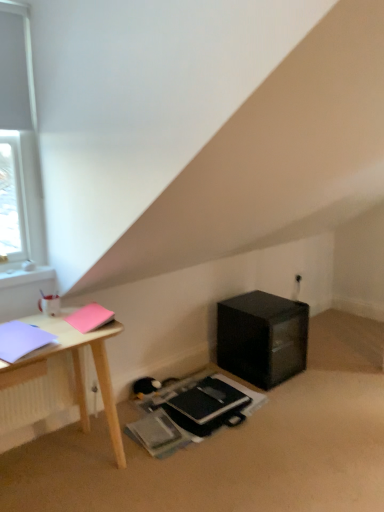
Question: In terms of height, does matte purple notebook at left, which ranks as the 3th notebook in back-to-front order, look taller or shorter compared to pink matte notebook at upper left, placed as the first notebook when sorted from top to bottom?

Choices:
 (A) short
 (B) tall

Answer: (A)

Question: Considering the positions of matte purple notebook at left, which ranks as the 3th notebook in back-to-front order, and pink matte notebook at upper left, the 2th notebook positioned from the back, in the image, is matte purple notebook at left, which ranks as the 3th notebook in back-to-front order, bigger or smaller than pink matte notebook at upper left, the 2th notebook positioned from the back,?

Choices:
 (A) big
 (B) small

Answer: (A)

Question: Estimate the real-world distances between objects in this image. Which object is farther from the matte purple notebook at left, marked as the 1th notebook in a left-to-right arrangement?

Choices:
 (A) pink matte notebook at upper left, the second notebook viewed from the front
 (B) black matte notebook at lower center, placed as the 1th notebook when sorted from back to front
 (C) black plastic at lower right
 (D) white matte window at upper left

Answer: (C)

Question: Estimate the real-world distances between objects in this image. Which object is farther from the pink matte notebook at upper left, which is the 3th notebook from bottom to top?

Choices:
 (A) black plastic at lower right
 (B) matte purple notebook at left, the 3th notebook from the right
 (C) white matte window at upper left
 (D) black matte notebook at lower center, placed as the 1th notebook when sorted from back to front

Answer: (A)